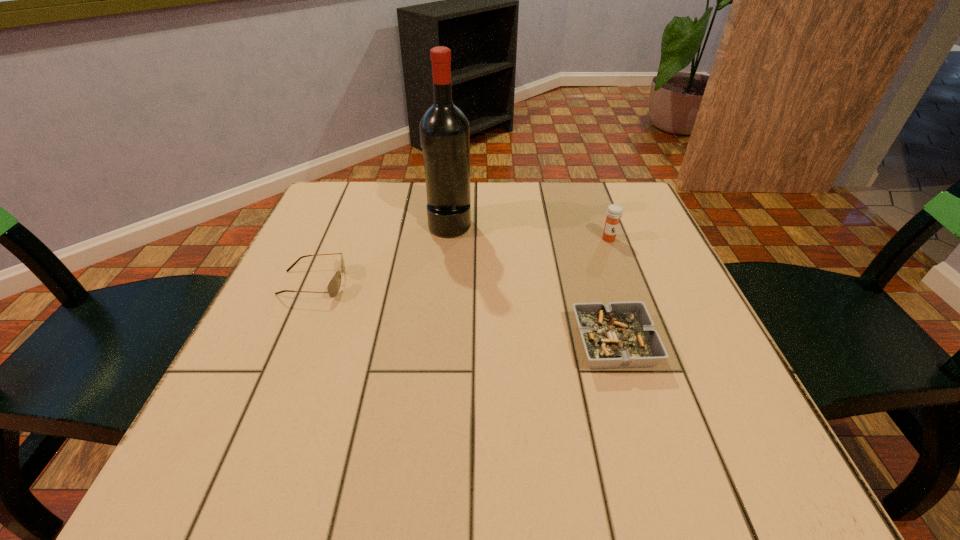
The height and width of the screenshot is (540, 960). Find the location of `the second object from left to right`. the second object from left to right is located at coordinates (444, 129).

What are the coordinates of `the tallest object` in the screenshot? It's located at pos(444,129).

Locate an element on the screen. The image size is (960, 540). medicine is located at coordinates (614, 212).

Where is `the second nearest object`? The height and width of the screenshot is (540, 960). the second nearest object is located at coordinates (334, 285).

Locate an element on the screen. Image resolution: width=960 pixels, height=540 pixels. sunglasses is located at coordinates (334, 285).

In order to click on ashtray in this screenshot , I will do `click(619, 334)`.

Where is `vacant space located 0.350m on the front of the tallest object`? This screenshot has width=960, height=540. vacant space located 0.350m on the front of the tallest object is located at coordinates point(438,359).

Locate an element on the screen. The image size is (960, 540). free location located on the label side of the medicine is located at coordinates (663, 386).

Image resolution: width=960 pixels, height=540 pixels. I want to click on free spot located on the front-facing side of the sunglasses, so (x=369, y=283).

This screenshot has width=960, height=540. Find the location of `vacant space located on the left of the ashtray`. vacant space located on the left of the ashtray is located at coordinates pos(502,344).